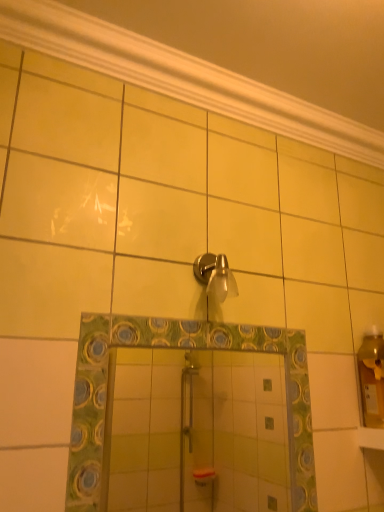
What is the approximate width of satin nickel shower head at upper center?

It is 10.99 centimeters.

In order to click on white glossy molding at upper center in this screenshot , I will do `click(182, 77)`.

Where is `satin nickel shower head at upper center`? The height and width of the screenshot is (512, 384). satin nickel shower head at upper center is located at coordinates (215, 276).

Between green mosaic mirror at center and satin nickel shower head at upper center, which one has larger width?

satin nickel shower head at upper center is wider.

Is point (238, 369) closer to viewer compared to point (203, 270)?

That is False.

Which of these two, green mosaic mirror at center or satin nickel shower head at upper center, is smaller?

With smaller size is satin nickel shower head at upper center.

At what (x,y) coordinates should I click in order to perform the action: click on mirror that appears on the left of satin nickel shower head at upper center. Please return your answer as a coordinate pair (x, y). Looking at the image, I should click on (199, 432).

Does satin nickel shower head at upper center appear on the right side of green mosaic mirror at center?

Indeed, satin nickel shower head at upper center is positioned on the right side of green mosaic mirror at center.

Would you say satin nickel shower head at upper center is outside green mosaic mirror at center?

Indeed, satin nickel shower head at upper center is completely outside green mosaic mirror at center.

Which object is wider, satin nickel shower head at upper center or green mosaic mirror at center?

With larger width is satin nickel shower head at upper center.

Is satin nickel shower head at upper center with green mosaic mirror at center?

No, satin nickel shower head at upper center is not beside green mosaic mirror at center.

From a real-world perspective, is white glossy molding at upper center on green mosaic mirror at center?

Yes, from a real-world perspective, white glossy molding at upper center is over green mosaic mirror at center

The width and height of the screenshot is (384, 512). Identify the location of mirror that appears on the left of white glossy molding at upper center. (199, 432).

Is white glossy molding at upper center oriented away from green mosaic mirror at center?

No, white glossy molding at upper center is not facing the opposite direction of green mosaic mirror at center.

Is green mosaic mirror at center completely or partially inside white glossy molding at upper center?

No, green mosaic mirror at center is not inside white glossy molding at upper center.

Does green mosaic mirror at center appear on the right side of white glossy molding at upper center?

No.

Considering the relative sizes of green mosaic mirror at center and white glossy molding at upper center in the image provided, is green mosaic mirror at center smaller than white glossy molding at upper center?

Actually, green mosaic mirror at center might be larger than white glossy molding at upper center.

Would you say white glossy molding at upper center is part of green mosaic mirror at center's contents?

No, white glossy molding at upper center is located outside of green mosaic mirror at center.

Considering the relative sizes of white glossy molding at upper center and satin nickel shower head at upper center in the image provided, is white glossy molding at upper center bigger than satin nickel shower head at upper center?

Yes, white glossy molding at upper center is bigger than satin nickel shower head at upper center.

From the image's perspective, is white glossy molding at upper center under satin nickel shower head at upper center?

No.

In terms of height, does white glossy molding at upper center look taller or shorter compared to satin nickel shower head at upper center?

Considering their sizes, white glossy molding at upper center has less height than satin nickel shower head at upper center.

Considering the positions of point (211, 71) and point (228, 283), is point (211, 71) closer or farther from the camera than point (228, 283)?

Point (211, 71) is farther from the camera than point (228, 283).

Find the location of a particular element. shower beneath the white glossy molding at upper center (from a real-world perspective) is located at coordinates coord(215,276).

Are satin nickel shower head at upper center and white glossy molding at upper center far apart?

Answer: satin nickel shower head at upper center is actually quite close to white glossy molding at upper center.

Which of these two, satin nickel shower head at upper center or white glossy molding at upper center, is bigger?

With larger size is white glossy molding at upper center.

Considering the sizes of satin nickel shower head at upper center and white glossy molding at upper center in the image, is satin nickel shower head at upper center wider or thinner than white glossy molding at upper center?

In the image, satin nickel shower head at upper center appears to be more narrow than white glossy molding at upper center.

Image resolution: width=384 pixels, height=512 pixels. In order to click on shower on the right of green mosaic mirror at center in this screenshot , I will do [215, 276].

You are a GUI agent. You are given a task and a screenshot of the screen. Output one action in this format:
    pyautogui.click(x=<x>, y=<y>)
    Task: Click on the shower that is behind the green mosaic mirror at center
    
    Given the screenshot: What is the action you would take?
    pyautogui.click(x=215, y=276)

Which object lies further to the anchor point green mosaic mirror at center, white glossy molding at upper center or satin nickel shower head at upper center?

white glossy molding at upper center lies further to green mosaic mirror at center than the other object.

When comparing their distances from green mosaic mirror at center, does satin nickel shower head at upper center or white glossy molding at upper center seem closer?

satin nickel shower head at upper center.

In the scene shown: Estimate the real-world distances between objects in this image. Which object is closer to satin nickel shower head at upper center, white glossy molding at upper center or green mosaic mirror at center?

white glossy molding at upper center is closer to satin nickel shower head at upper center.

Which object lies further to the anchor point white glossy molding at upper center, green mosaic mirror at center or satin nickel shower head at upper center?

green mosaic mirror at center is positioned further to the anchor white glossy molding at upper center.

From the image, which object appears to be farther from satin nickel shower head at upper center, green mosaic mirror at center or white glossy molding at upper center?

Based on the image, green mosaic mirror at center appears to be further to satin nickel shower head at upper center.

From the image, which object appears to be nearer to white glossy molding at upper center, satin nickel shower head at upper center or green mosaic mirror at center?

satin nickel shower head at upper center.

The image size is (384, 512). What are the coordinates of `shower that lies between white glossy molding at upper center and green mosaic mirror at center from top to bottom` in the screenshot? It's located at (215, 276).